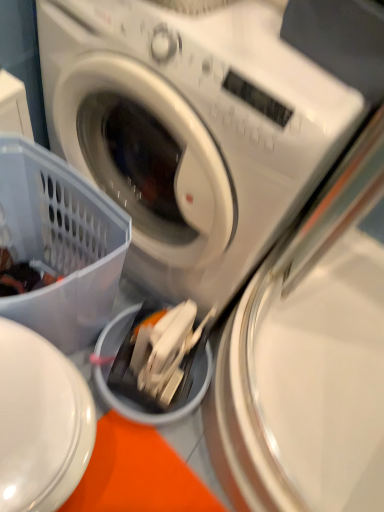
This screenshot has height=512, width=384. I want to click on white plastic washing machine at center, the first washing machine when ordered from top to bottom, so click(191, 131).

Find the location of `translucent plastic basket at lower left`. translucent plastic basket at lower left is located at coordinates (60, 243).

Is white plastic washing machine at center, the first washing machine when ordered from top to bottom, a part of translucent plastic basket at lower left?

Actually, white plastic washing machine at center, the first washing machine when ordered from top to bottom, is outside translucent plastic basket at lower left.

Who is shorter, translucent plastic basket at lower left or white plastic washing machine at center, positioned as the 2th washing machine in bottom-to-top order?

translucent plastic basket at lower left is shorter.

Does translucent plastic basket at lower left come in front of white plastic washing machine at center, positioned as the 2th washing machine in bottom-to-top order?

No, it is behind white plastic washing machine at center, positioned as the 2th washing machine in bottom-to-top order.

Can you confirm if translucent plastic basket at lower left is bigger than white plastic washing machine at center, positioned as the 2th washing machine in bottom-to-top order?

No.

From a real-world perspective, is translucent plastic basket at lower left physically below metallic silver washing machine at center, which appears as the 1th washing machine when ordered from the bottom?

No, from a real-world perspective, translucent plastic basket at lower left is not below metallic silver washing machine at center, which appears as the 1th washing machine when ordered from the bottom.

What are the coordinates of `washing machine that appears below the translucent plastic basket at lower left (from a real-world perspective)` in the screenshot? It's located at (309, 358).

Which is less distant, (x=61, y=333) or (x=366, y=247)?

Point (x=61, y=333) is positioned closer to the camera compared to point (x=366, y=247).

Is translucent plastic basket at lower left inside or outside of metallic silver washing machine at center, positioned as the 2th washing machine in top-to-bottom order?

translucent plastic basket at lower left is outside metallic silver washing machine at center, positioned as the 2th washing machine in top-to-bottom order.

This screenshot has width=384, height=512. Identify the location of basket on the left of white plastic washing machine at center, positioned as the 2th washing machine in bottom-to-top order. [60, 243].

Is translucent plastic basket at lower left inside white plastic washing machine at center, positioned as the 2th washing machine in bottom-to-top order?

No, translucent plastic basket at lower left is not a part of white plastic washing machine at center, positioned as the 2th washing machine in bottom-to-top order.

Is white plastic washing machine at center, the first washing machine when ordered from top to bottom, not close to translucent plastic basket at lower left?

No, there isn't a large distance between white plastic washing machine at center, the first washing machine when ordered from top to bottom, and translucent plastic basket at lower left.

Is metallic silver washing machine at center, which appears as the 1th washing machine when ordered from the bottom, thinner than translucent plastic basket at lower left?

In fact, metallic silver washing machine at center, which appears as the 1th washing machine when ordered from the bottom, might be wider than translucent plastic basket at lower left.

Considering the sizes of metallic silver washing machine at center, positioned as the 2th washing machine in top-to-bottom order, and translucent plastic basket at lower left in the image, is metallic silver washing machine at center, positioned as the 2th washing machine in top-to-bottom order, bigger or smaller than translucent plastic basket at lower left?

In the image, metallic silver washing machine at center, positioned as the 2th washing machine in top-to-bottom order, appears to be larger than translucent plastic basket at lower left.

Can you confirm if metallic silver washing machine at center, positioned as the 2th washing machine in top-to-bottom order, is positioned to the right of translucent plastic basket at lower left?

Yes, metallic silver washing machine at center, positioned as the 2th washing machine in top-to-bottom order, is to the right of translucent plastic basket at lower left.

Considering the sizes of objects metallic silver washing machine at center, which appears as the 1th washing machine when ordered from the bottom, and white plastic washing machine at center, positioned as the 2th washing machine in bottom-to-top order, in the image provided, who is shorter, metallic silver washing machine at center, which appears as the 1th washing machine when ordered from the bottom, or white plastic washing machine at center, positioned as the 2th washing machine in bottom-to-top order,?

metallic silver washing machine at center, which appears as the 1th washing machine when ordered from the bottom.

Which object is further away from the camera taking this photo, metallic silver washing machine at center, which appears as the 1th washing machine when ordered from the bottom, or white plastic washing machine at center, the first washing machine when ordered from top to bottom?

metallic silver washing machine at center, which appears as the 1th washing machine when ordered from the bottom, is more distant.

From a real-world perspective, between metallic silver washing machine at center, which appears as the 1th washing machine when ordered from the bottom, and white plastic washing machine at center, positioned as the 2th washing machine in bottom-to-top order, who is vertically lower?

metallic silver washing machine at center, which appears as the 1th washing machine when ordered from the bottom.

Identify the location of washing machine on the right side of white plastic washing machine at center, the first washing machine when ordered from top to bottom. (309, 358).

Is white plastic washing machine at center, the first washing machine when ordered from top to bottom, outside of metallic silver washing machine at center, which appears as the 1th washing machine when ordered from the bottom?

Yes, white plastic washing machine at center, the first washing machine when ordered from top to bottom, is not within metallic silver washing machine at center, which appears as the 1th washing machine when ordered from the bottom.

From a real-world perspective, is white plastic washing machine at center, positioned as the 2th washing machine in bottom-to-top order, physically located above or below metallic silver washing machine at center, positioned as the 2th washing machine in top-to-bottom order?

Clearly, from a real-world perspective, white plastic washing machine at center, positioned as the 2th washing machine in bottom-to-top order, is above metallic silver washing machine at center, positioned as the 2th washing machine in top-to-bottom order.

This screenshot has height=512, width=384. Find the location of `washing machine located in front of the metallic silver washing machine at center, which appears as the 1th washing machine when ordered from the bottom`. washing machine located in front of the metallic silver washing machine at center, which appears as the 1th washing machine when ordered from the bottom is located at coordinates pyautogui.click(x=191, y=131).

Is white plastic washing machine at center, positioned as the 2th washing machine in bottom-to-top order, positioned behind metallic silver washing machine at center, which appears as the 1th washing machine when ordered from the bottom?

No.

From the translucent plastic basket at lower left, count 1st washing machine to the right and point to it. Please provide its 2D coordinates.

[(191, 131)]

At what (x,y) coordinates should I click in order to perform the action: click on basket on the left of metallic silver washing machine at center, which appears as the 1th washing machine when ordered from the bottom. Please return your answer as a coordinate pair (x, y). The image size is (384, 512). Looking at the image, I should click on (60, 243).

From the image, which object appears to be nearer to white plastic washing machine at center, the first washing machine when ordered from top to bottom, translucent plastic basket at lower left or metallic silver washing machine at center, which appears as the 1th washing machine when ordered from the bottom?

translucent plastic basket at lower left lies closer to white plastic washing machine at center, the first washing machine when ordered from top to bottom, than the other object.

Considering their positions, is white plastic washing machine at center, positioned as the 2th washing machine in bottom-to-top order, positioned further to translucent plastic basket at lower left than metallic silver washing machine at center, positioned as the 2th washing machine in top-to-bottom order?

The object further to translucent plastic basket at lower left is metallic silver washing machine at center, positioned as the 2th washing machine in top-to-bottom order.

Which object lies nearer to the anchor point metallic silver washing machine at center, positioned as the 2th washing machine in top-to-bottom order, white plastic washing machine at center, positioned as the 2th washing machine in bottom-to-top order, or translucent plastic basket at lower left?

Based on the image, white plastic washing machine at center, positioned as the 2th washing machine in bottom-to-top order, appears to be nearer to metallic silver washing machine at center, positioned as the 2th washing machine in top-to-bottom order.

From the image, which object appears to be farther from metallic silver washing machine at center, which appears as the 1th washing machine when ordered from the bottom, translucent plastic basket at lower left or white plastic washing machine at center, positioned as the 2th washing machine in bottom-to-top order?

translucent plastic basket at lower left is positioned further to the anchor metallic silver washing machine at center, which appears as the 1th washing machine when ordered from the bottom.

Estimate the real-world distances between objects in this image. Which object is closer to white plastic washing machine at center, positioned as the 2th washing machine in bottom-to-top order, metallic silver washing machine at center, positioned as the 2th washing machine in top-to-bottom order, or translucent plastic basket at lower left?

Among the two, translucent plastic basket at lower left is located nearer to white plastic washing machine at center, positioned as the 2th washing machine in bottom-to-top order.

Based on their spatial positions, is metallic silver washing machine at center, which appears as the 1th washing machine when ordered from the bottom, or white plastic washing machine at center, positioned as the 2th washing machine in bottom-to-top order, closer to translucent plastic basket at lower left?

The object closer to translucent plastic basket at lower left is white plastic washing machine at center, positioned as the 2th washing machine in bottom-to-top order.

Where is `washing machine between translucent plastic basket at lower left and metallic silver washing machine at center, which appears as the 1th washing machine when ordered from the bottom`? washing machine between translucent plastic basket at lower left and metallic silver washing machine at center, which appears as the 1th washing machine when ordered from the bottom is located at coordinates (191, 131).